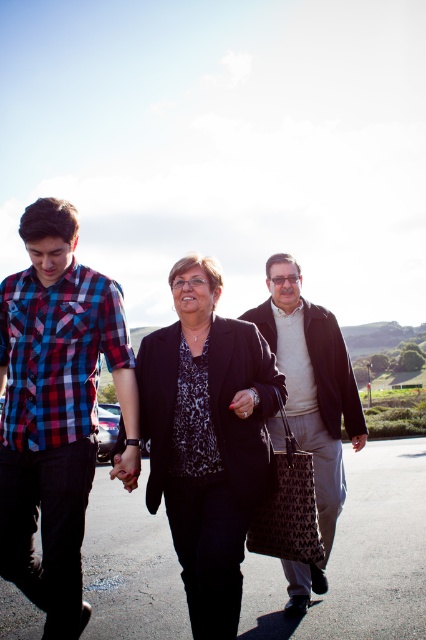
Question: Among these objects, which one is nearest to the camera?

Choices:
 (A) black printed fabric bag at center
 (B) dark brown leather jacket at center

Answer: (A)

Question: Among these points, which one is farthest from the camera?

Choices:
 (A) (264, 554)
 (B) (94, 627)
 (C) (278, 307)

Answer: (C)

Question: Which point is farther to the camera?

Choices:
 (A) (316, 547)
 (B) (193, 385)
 (C) (32, 205)
 (D) (141, 404)

Answer: (D)

Question: Does plaid cotton shirt at left have a larger size compared to black fabric parking lot at center?

Choices:
 (A) yes
 (B) no

Answer: (B)

Question: Is plaid cotton shirt at left smaller than dark brown leather jacket at center?

Choices:
 (A) no
 (B) yes

Answer: (B)

Question: Is matte black blazer at center smaller than dark brown leather jacket at center?

Choices:
 (A) yes
 (B) no

Answer: (A)